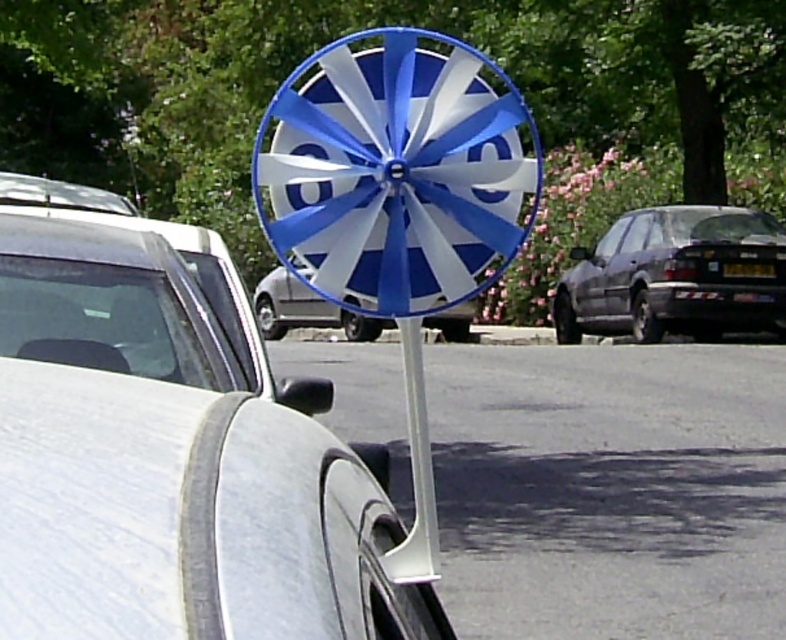
You are standing at the entrance of the parking lot and want to know the distance between the white matte car at center and the metallic silver van at center. Can you estimate how far apart they are?

The white matte car at center is 19.61 meters from the metallic silver van at center.